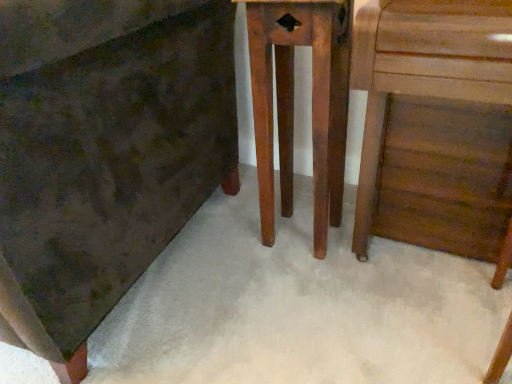
At what (x,y) coordinates should I click in order to perform the action: click on vacant space to the right of wooden table at center. Please return your answer as a coordinate pair (x, y). This screenshot has width=512, height=384. Looking at the image, I should click on (373, 247).